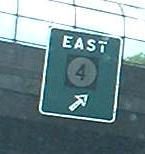
You are a GUI agent. You are given a task and a screenshot of the screen. Output one action in this format:
    pyautogui.click(x=<x>, y=<y>)
    Task: Click on the wall
    
    Given the screenshot: What is the action you would take?
    pos(17,72)